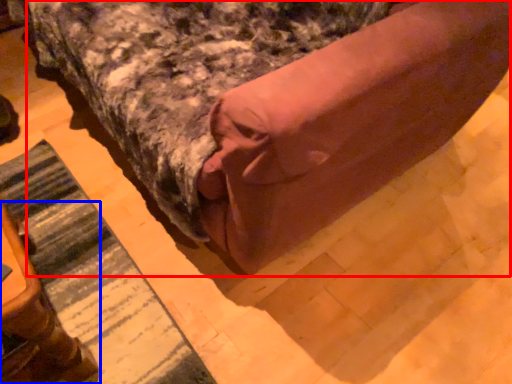
Question: Which object is further to the camera taking this photo, bed (highlighted by a red box) or furniture (highlighted by a blue box)?

Choices:
 (A) bed
 (B) furniture

Answer: (B)